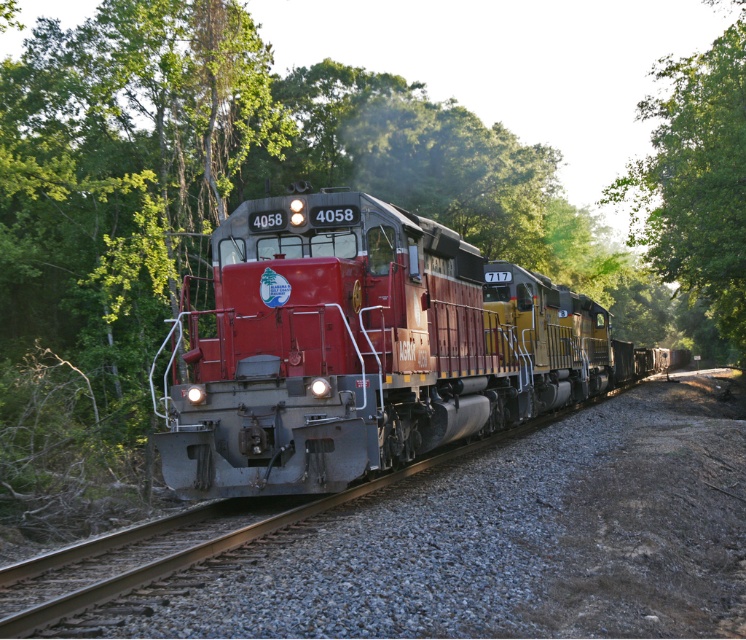
Question: Is matte red train at center above green leafy tree at right?

Choices:
 (A) yes
 (B) no

Answer: (B)

Question: Can you confirm if matte red train at center is positioned above green leafy tree at right?

Choices:
 (A) yes
 (B) no

Answer: (B)

Question: Can you confirm if matte red train at center is positioned to the left of green leafy tree at right?

Choices:
 (A) no
 (B) yes

Answer: (B)

Question: Which point is closer to the camera?

Choices:
 (A) green leafy tree at right
 (B) matte red train at center

Answer: (B)

Question: Which object appears farthest from the camera in this image?

Choices:
 (A) green leafy tree at right
 (B) matte red train at center

Answer: (A)